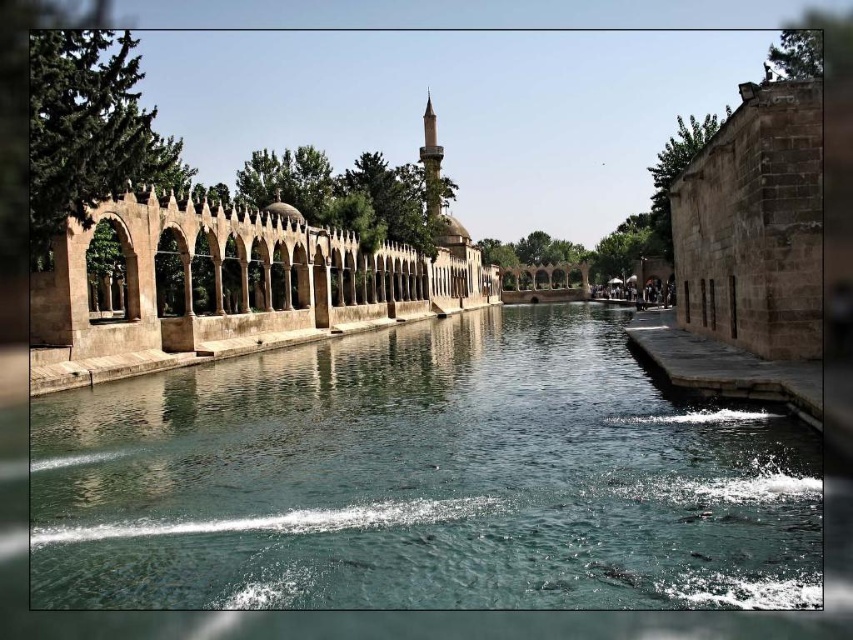
Question: Which point appears farthest from the camera in this image?

Choices:
 (A) (134, 198)
 (B) (386, 424)

Answer: (A)

Question: Is clear stone water at center smaller than brown stone palace at center?

Choices:
 (A) no
 (B) yes

Answer: (B)

Question: Which point is farther to the camera?

Choices:
 (A) clear stone water at center
 (B) brown stone palace at center

Answer: (B)

Question: Is clear stone water at center bigger than brown stone palace at center?

Choices:
 (A) no
 (B) yes

Answer: (A)

Question: Can you confirm if clear stone water at center is positioned below brown stone palace at center?

Choices:
 (A) no
 (B) yes

Answer: (B)